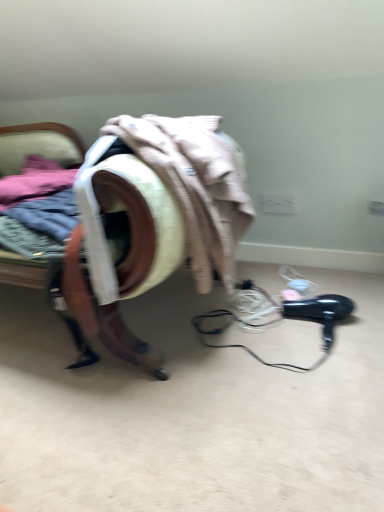
Question: In terms of height, does velvet-like armchair at center look taller or shorter compared to black plastic hair dryer at lower right?

Choices:
 (A) tall
 (B) short

Answer: (A)

Question: Is velvet-like armchair at center in front of or behind black plastic hair dryer at lower right in the image?

Choices:
 (A) behind
 (B) front

Answer: (B)

Question: Is velvet-like armchair at center wider or thinner than black plastic hair dryer at lower right?

Choices:
 (A) thin
 (B) wide

Answer: (B)

Question: Looking at their shapes, would you say black plastic hair dryer at lower right is wider or thinner than velvet-like armchair at center?

Choices:
 (A) wide
 (B) thin

Answer: (B)

Question: In terms of height, does black plastic hair dryer at lower right look taller or shorter compared to velvet-like armchair at center?

Choices:
 (A) tall
 (B) short

Answer: (B)

Question: Looking at the image, does black plastic hair dryer at lower right seem bigger or smaller compared to velvet-like armchair at center?

Choices:
 (A) big
 (B) small

Answer: (B)

Question: From a real-world perspective, is black plastic hair dryer at lower right positioned above or below velvet-like armchair at center?

Choices:
 (A) above
 (B) below

Answer: (B)